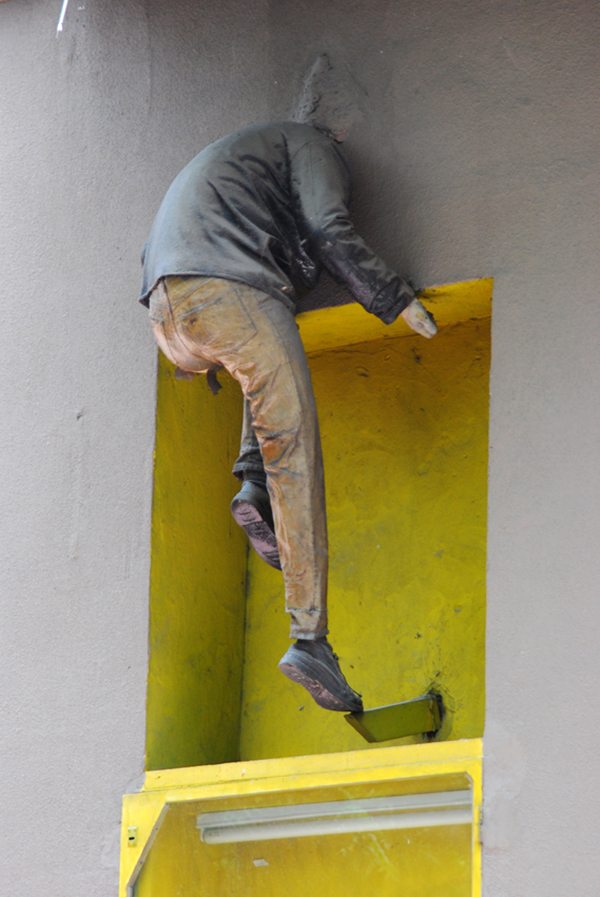
Where is `gray concrete wall`? The image size is (600, 897). gray concrete wall is located at coordinates click(61, 239), click(547, 173).